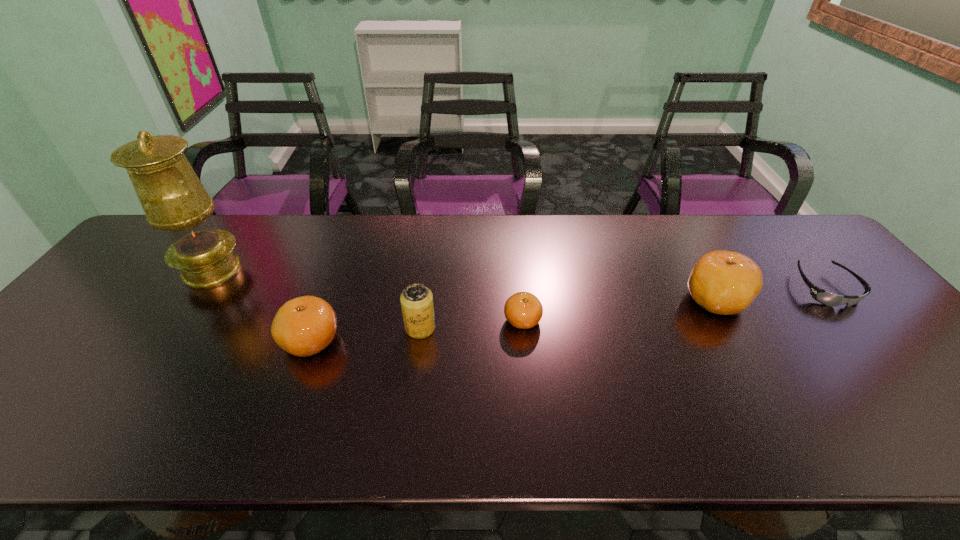
Please point a spot to add another clementine on the left. Please provide its 2D coordinates. Your answer should be formatted as a tuple, i.e. [(x, y)], where the tuple contains the x and y coordinates of a point satisfying the conditions above.

[(78, 365)]